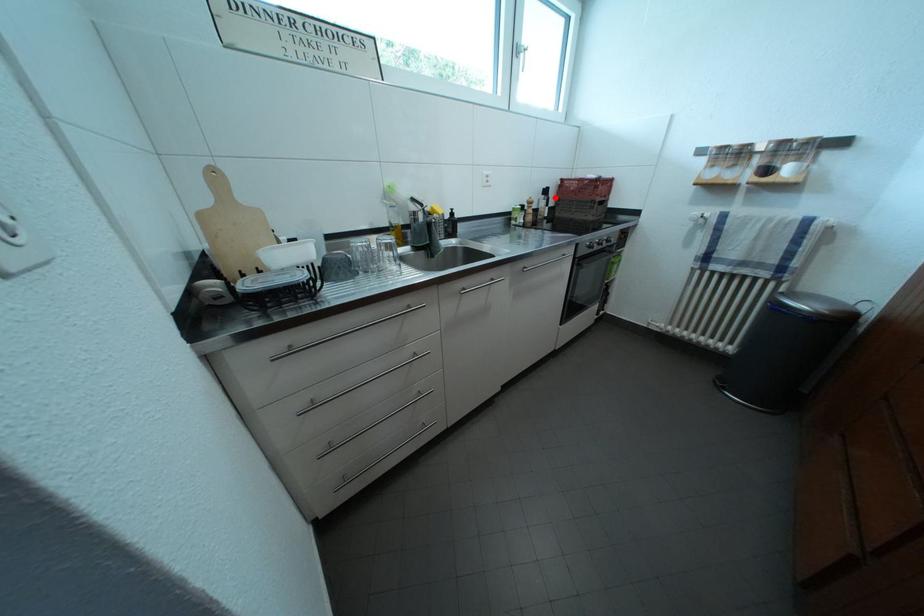
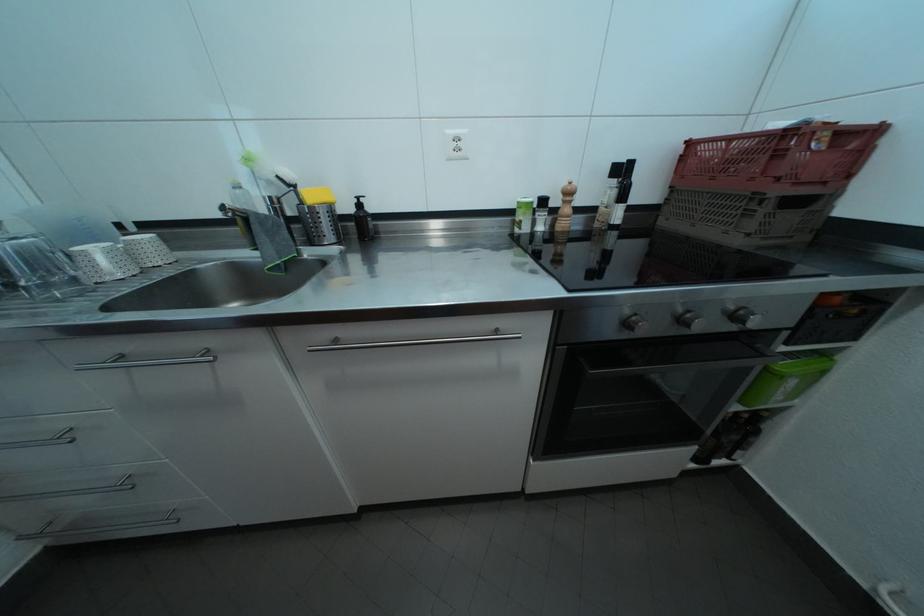
Find the pixel in the second image that matches the highlighted location in the first image.

(630, 176)